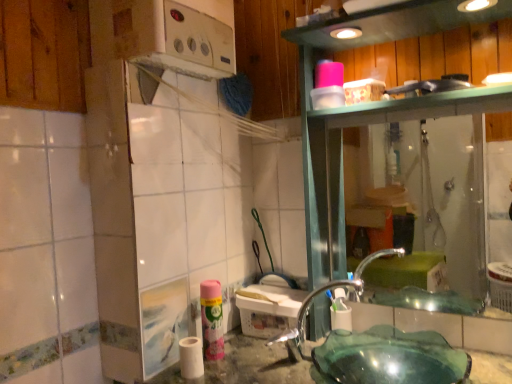
Question: Does transparent glass shower at right touch white matte toilet paper at lower center?

Choices:
 (A) yes
 (B) no

Answer: (B)

Question: Is transparent glass shower at right further to the viewer compared to white matte toilet paper at lower center?

Choices:
 (A) yes
 (B) no

Answer: (A)

Question: Considering the relative positions of transparent glass shower at right and white matte toilet paper at lower center in the image provided, is transparent glass shower at right to the right of white matte toilet paper at lower center from the viewer's perspective?

Choices:
 (A) no
 (B) yes

Answer: (B)

Question: Does transparent glass shower at right have a smaller size compared to white matte toilet paper at lower center?

Choices:
 (A) no
 (B) yes

Answer: (A)

Question: Is the position of transparent glass shower at right less distant than that of white matte toilet paper at lower center?

Choices:
 (A) yes
 (B) no

Answer: (B)

Question: Relative to pink matte spray can at lower center, is white matte toilet paper at lower center in front or behind?

Choices:
 (A) behind
 (B) front

Answer: (B)

Question: Does point (192, 354) appear closer or farther from the camera than point (212, 279)?

Choices:
 (A) closer
 (B) farther

Answer: (A)

Question: Is white matte toilet paper at lower center wider or thinner than pink matte spray can at lower center?

Choices:
 (A) thin
 (B) wide

Answer: (B)

Question: Is white matte toilet paper at lower center situated inside pink matte spray can at lower center or outside?

Choices:
 (A) outside
 (B) inside

Answer: (A)

Question: Considering the positions of pink matte spray can at lower center and pink matte shaving cream at lower center in the image, is pink matte spray can at lower center bigger or smaller than pink matte shaving cream at lower center?

Choices:
 (A) small
 (B) big

Answer: (B)

Question: Does point pos(212,352) appear closer or farther from the camera than point pos(336,324)?

Choices:
 (A) closer
 (B) farther

Answer: (A)

Question: From their relative heights in the image, would you say pink matte spray can at lower center is taller or shorter than pink matte shaving cream at lower center?

Choices:
 (A) tall
 (B) short

Answer: (A)

Question: Is pink matte spray can at lower center inside or outside of pink matte shaving cream at lower center?

Choices:
 (A) inside
 (B) outside

Answer: (B)

Question: Would you say pink matte shaving cream at lower center is to the left or to the right of clear glass faucet at lower center in the picture?

Choices:
 (A) left
 (B) right

Answer: (B)

Question: From a real-world perspective, is pink matte shaving cream at lower center positioned above or below clear glass faucet at lower center?

Choices:
 (A) above
 (B) below

Answer: (B)